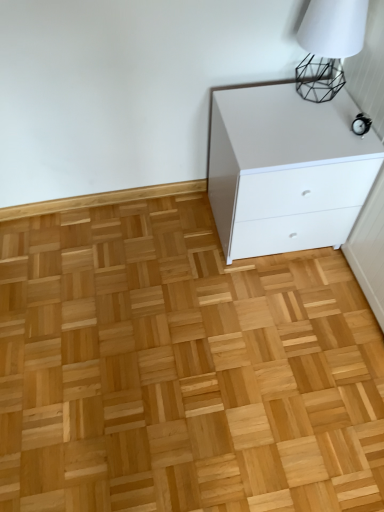
Question: Should I look upward or downward to see white matte table lamp at upper right?

Choices:
 (A) down
 (B) up

Answer: (B)

Question: Does natural wood floor at center have a larger size compared to white matte table lamp at upper right?

Choices:
 (A) yes
 (B) no

Answer: (A)

Question: From a real-world perspective, is natural wood floor at center physically above white matte table lamp at upper right?

Choices:
 (A) yes
 (B) no

Answer: (B)

Question: Is natural wood floor at center facing towards white matte table lamp at upper right?

Choices:
 (A) yes
 (B) no

Answer: (B)

Question: Does natural wood floor at center have a lesser height compared to white matte table lamp at upper right?

Choices:
 (A) yes
 (B) no

Answer: (A)

Question: Considering the relative sizes of natural wood floor at center and white matte table lamp at upper right in the image provided, is natural wood floor at center thinner than white matte table lamp at upper right?

Choices:
 (A) no
 (B) yes

Answer: (A)

Question: Is natural wood floor at center oriented away from white matte table lamp at upper right?

Choices:
 (A) no
 (B) yes

Answer: (A)

Question: Does white matte table lamp at upper right come behind natural wood floor at center?

Choices:
 (A) yes
 (B) no

Answer: (A)

Question: From a real-world perspective, is white matte table lamp at upper right located higher than natural wood floor at center?

Choices:
 (A) no
 (B) yes

Answer: (B)

Question: Is white matte table lamp at upper right facing towards natural wood floor at center?

Choices:
 (A) no
 (B) yes

Answer: (A)

Question: Is white matte table lamp at upper right not near natural wood floor at center?

Choices:
 (A) yes
 (B) no

Answer: (B)

Question: Are white matte table lamp at upper right and natural wood floor at center making contact?

Choices:
 (A) yes
 (B) no

Answer: (B)

Question: Can you confirm if white matte table lamp at upper right is wider than natural wood floor at center?

Choices:
 (A) no
 (B) yes

Answer: (A)

Question: Is white matte table lamp at upper right bigger than white glossy chest of drawers at upper right?

Choices:
 (A) no
 (B) yes

Answer: (A)